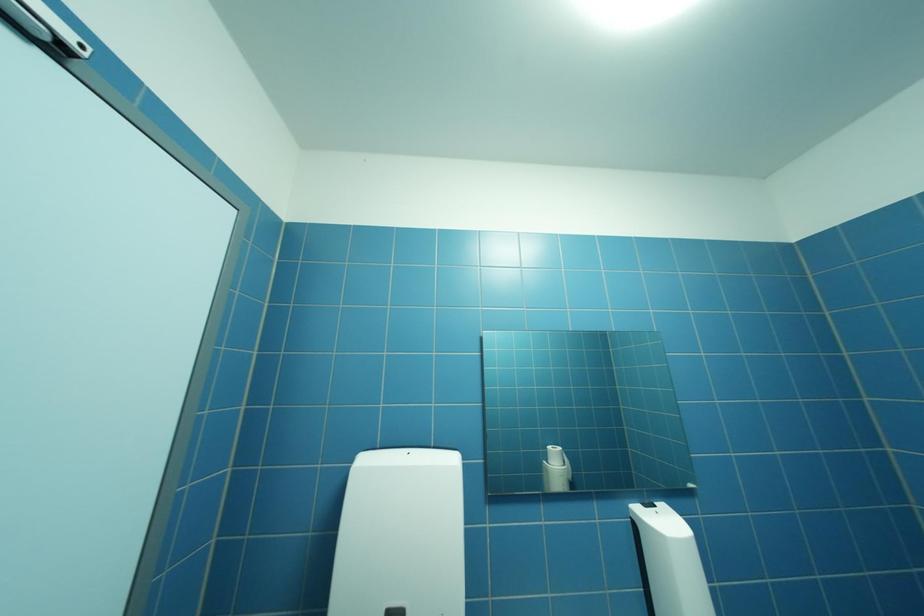
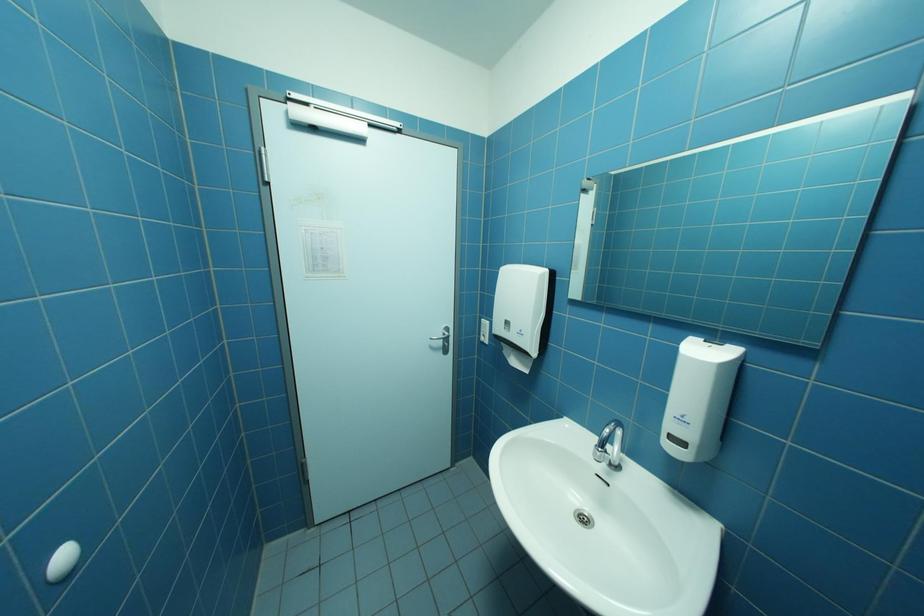
How did the camera likely rotate?

The camera's rotation is toward left-down.